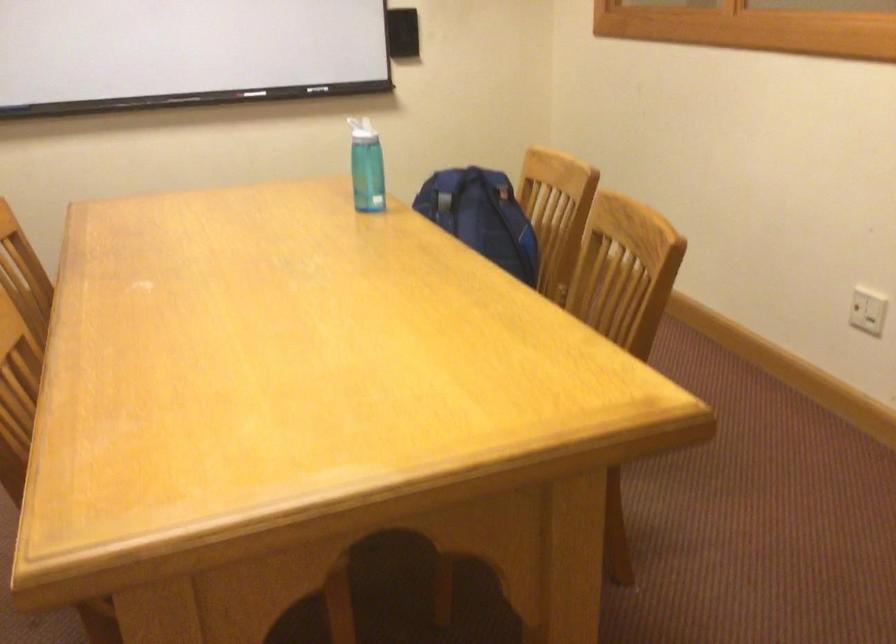
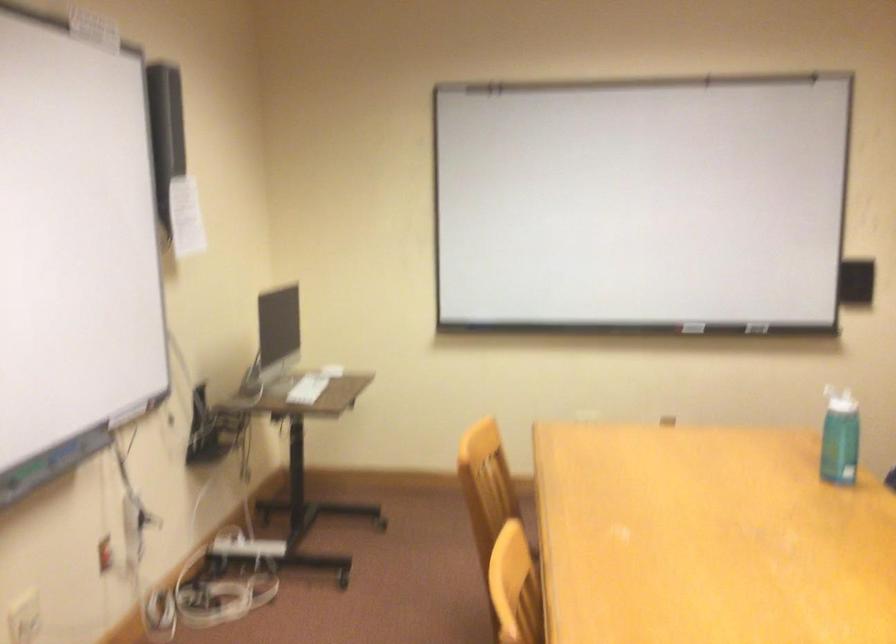
Question: The first image is from the beginning of the video and the second image is from the end. How did the camera likely rotate when shooting the video?

Choices:
 (A) Left
 (B) Right
 (C) Up
 (D) Down

Answer: (A)